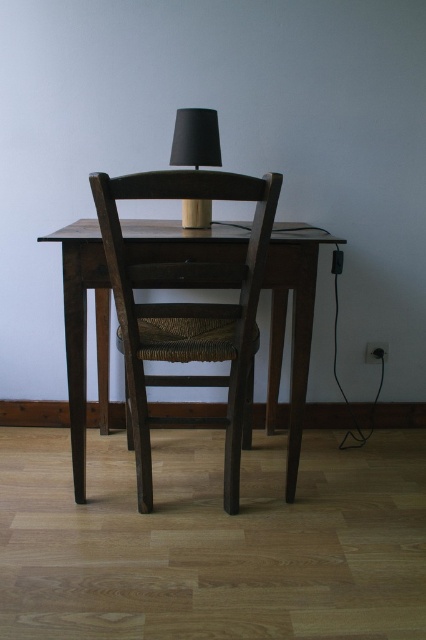
Question: Is dark wood chair at center to the left of black matte table lamp at center from the viewer's perspective?

Choices:
 (A) no
 (B) yes

Answer: (A)

Question: Is dark wood chair at center further to camera compared to black matte table lamp at center?

Choices:
 (A) no
 (B) yes

Answer: (A)

Question: Which point appears farthest from the camera in this image?

Choices:
 (A) (184, 208)
 (B) (199, 381)

Answer: (B)

Question: Which object appears farthest from the camera in this image?

Choices:
 (A) black matte table lamp at center
 (B) dark wood chair at center

Answer: (A)

Question: Can you confirm if dark wood chair at center is positioned below black matte table lamp at center?

Choices:
 (A) no
 (B) yes

Answer: (B)